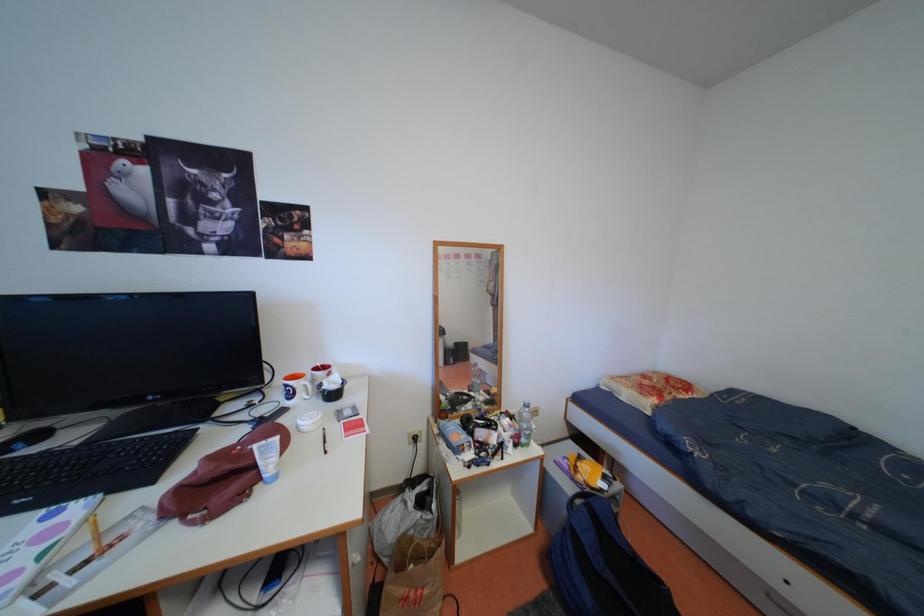
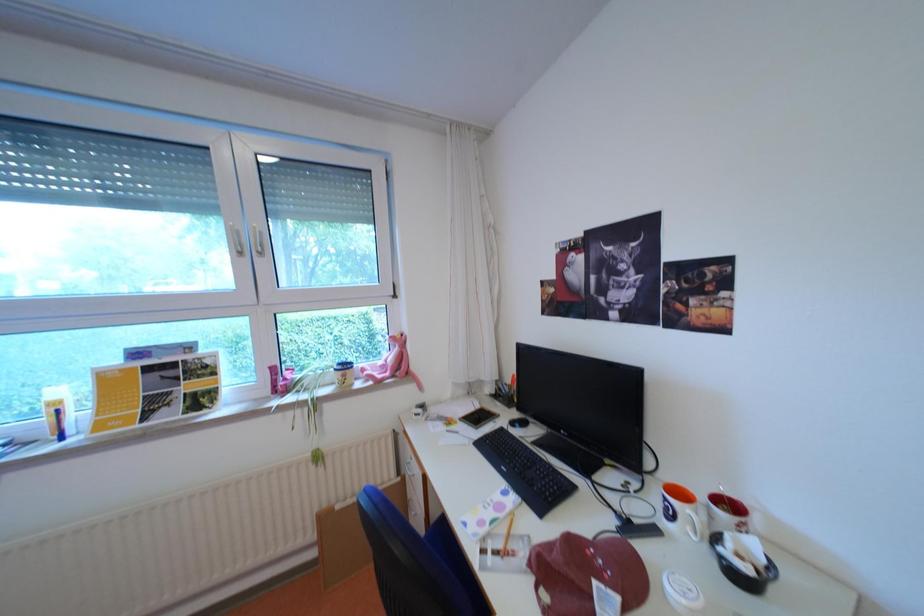
Question: Based on the continuous images, in which direction is the camera rotating? Reply with the corresponding letter.

Choices:
 (A) Left
 (B) Right
 (C) Up
 (D) Down

Answer: (A)